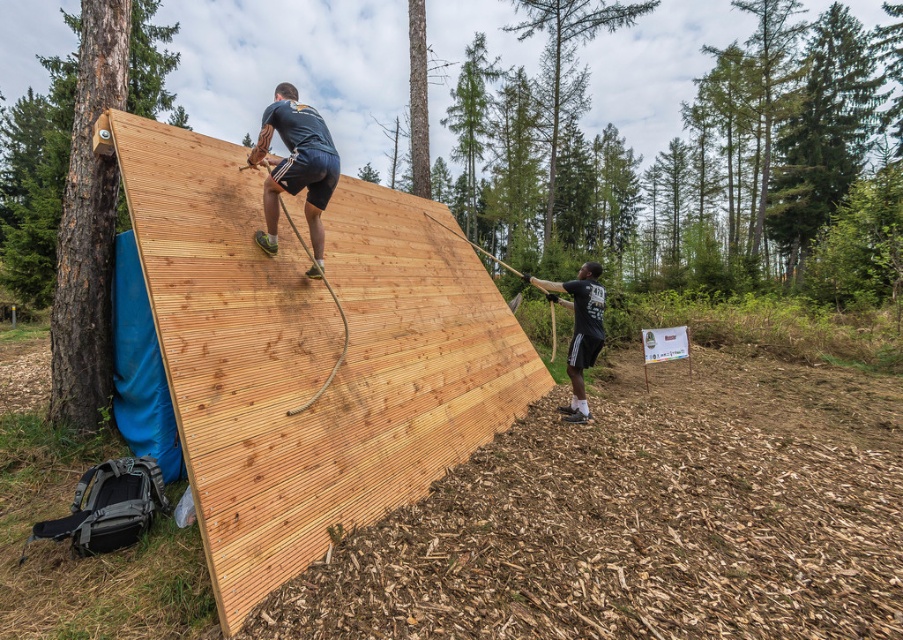
Question: Which point is farther to the camera?

Choices:
 (A) natural wood plywood at upper center
 (B) black matte shirt at right
 (C) green smooth bark tree at upper center

Answer: (C)

Question: Is natural wood plywood at upper center below black matte shirt at right?

Choices:
 (A) no
 (B) yes

Answer: (A)

Question: Which point is closer to the camera taking this photo?

Choices:
 (A) (557, 99)
 (B) (235, 451)
 (C) (591, 339)

Answer: (B)

Question: Is natural wood plywood at upper center wider than dark blue fabric at upper center?

Choices:
 (A) yes
 (B) no

Answer: (A)

Question: In this image, where is natural wood plywood at upper center located relative to dark blue fabric at upper center?

Choices:
 (A) left
 (B) right

Answer: (B)

Question: Which of the following is the farthest from the observer?

Choices:
 (A) green smooth bark tree at upper center
 (B) black matte shirt at right
 (C) natural wood plywood at upper center

Answer: (A)